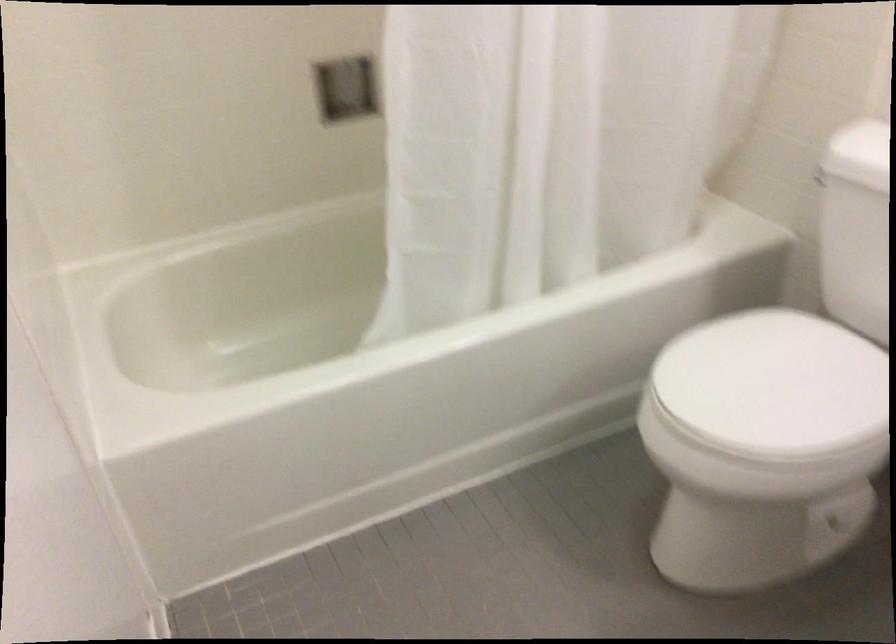
Describe the element at coordinates (773, 384) in the screenshot. This screenshot has width=896, height=644. I see `a white toilet lid` at that location.